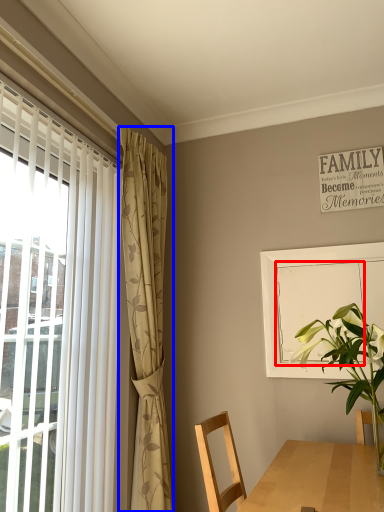
Question: Which of the following is the farthest to the observer, screen door (highlighted by a red box) or curtain (highlighted by a blue box)?

Choices:
 (A) screen door
 (B) curtain

Answer: (A)